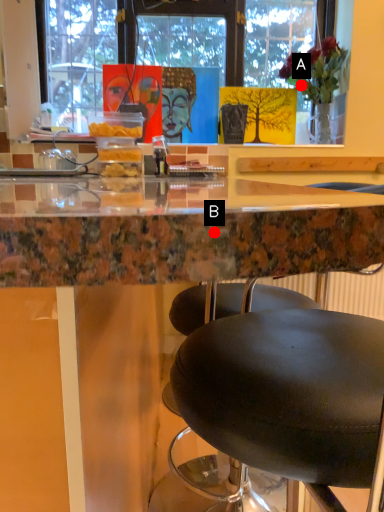
Question: Two points are circled on the image, labeled by A and B beside each circle. Which of the following is the closest to the observer?

Choices:
 (A) A is closer
 (B) B is closer

Answer: (B)